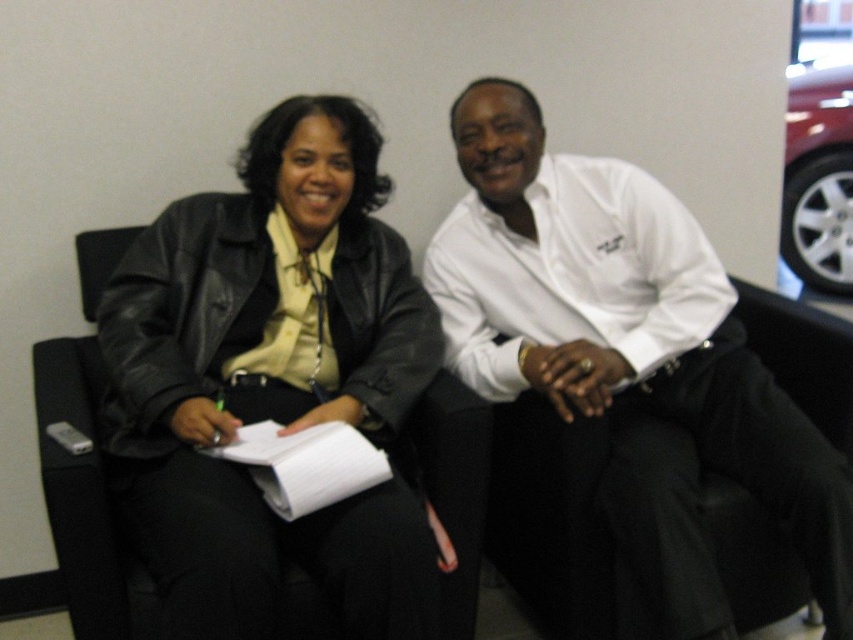
You are a delivery person standing in front of the couch. You need to place a small package between the black leather jacket at left and the person on the right. Can you fit the package there?

The distance of black leather jacket at left from viewer is 1.19 meters, but the exact space between the jacket and the person on the right is not provided. Without knowing the distance between them, it is impossible to determine if the package will fit.

You are a photographer setting up for a portrait session. The scene has a black leather jacket at left and a shiny metallic car at upper right. Where should you position your camera to ensure both objects are in frame?

Position the camera so it can capture both the black leather jacket at left and the shiny metallic car at upper right, as the jacket is to the left of the car.